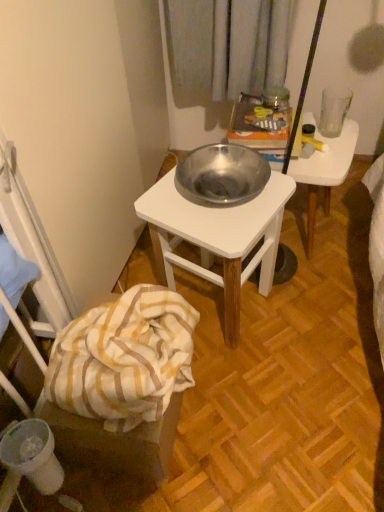
Where is `vacant space that is in between metallic white table at center and yellow striped fabric at lower left`? The image size is (384, 512). vacant space that is in between metallic white table at center and yellow striped fabric at lower left is located at coordinates (210, 392).